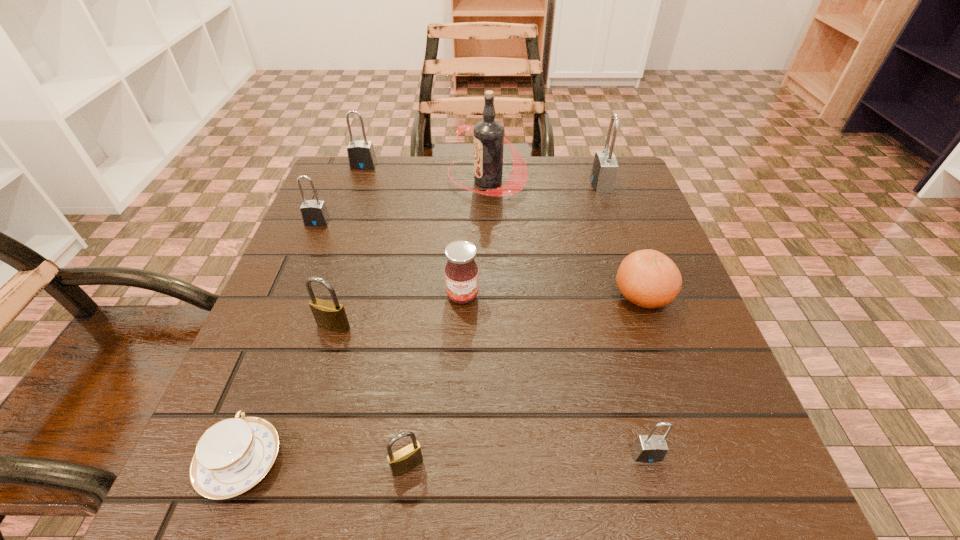
The width and height of the screenshot is (960, 540). I want to click on free space located 0.380m on the shackle of the ninth shortest object, so pos(438,184).

Find the location of `free location located on the shackle of the ninth shortest object`. free location located on the shackle of the ninth shortest object is located at coordinates (446, 184).

Locate an element on the screen. The height and width of the screenshot is (540, 960). free location located on the shackle of the ninth shortest object is located at coordinates (551, 184).

Identify the location of free space located 0.240m on the shackle of the eighth shortest object. (342, 228).

This screenshot has height=540, width=960. I want to click on vacant area located on the shackle of the fourth nearest padlock, so click(291, 285).

What are the coordinates of `vacant space located on the front of the farther brass padlock` in the screenshot? It's located at point(296,451).

Where is `vacant space situated 0.120m on the label side of the jam`? The image size is (960, 540). vacant space situated 0.120m on the label side of the jam is located at coordinates (460, 363).

Image resolution: width=960 pixels, height=540 pixels. Find the location of `free space located on the left of the clementine`. free space located on the left of the clementine is located at coordinates (x=554, y=295).

What are the coordinates of `free space located 0.050m on the shackle of the smallest gray padlock` in the screenshot? It's located at (660, 502).

The image size is (960, 540). What are the coordinates of `free spot located 0.060m on the right of the right brass padlock` in the screenshot? It's located at (467, 465).